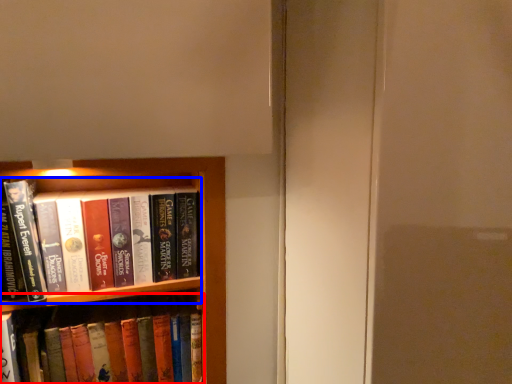
Question: Among these objects, which one is farthest to the camera, book (highlighted by a red box) or book (highlighted by a blue box)?

Choices:
 (A) book
 (B) book

Answer: (A)